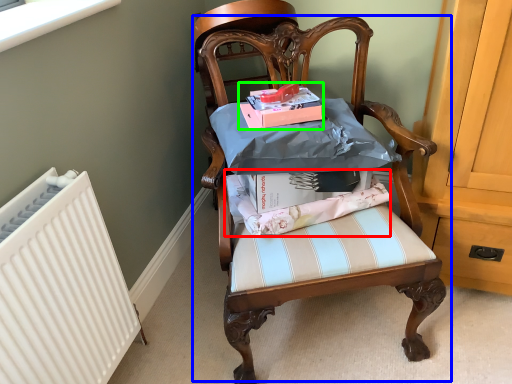
Question: Which is farther away from fabric (highlighted by a red box)? chair (highlighted by a blue box) or magazine (highlighted by a green box)?

Choices:
 (A) chair
 (B) magazine

Answer: (B)